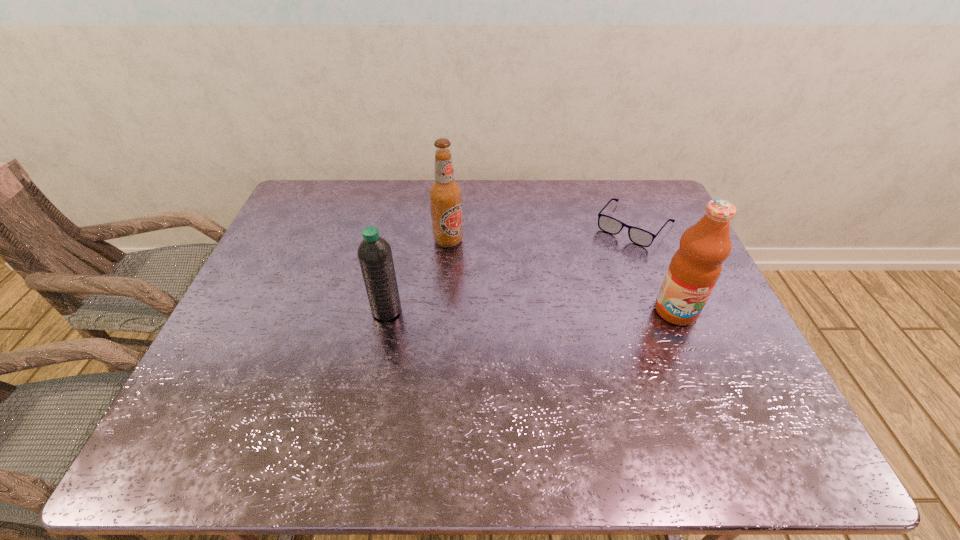
This screenshot has width=960, height=540. Find the location of `vacant space located on the front label of the beer bottle`. vacant space located on the front label of the beer bottle is located at coordinates (484, 284).

Locate an element on the screen. free region located on the front label of the beer bottle is located at coordinates (524, 333).

At what (x,y) coordinates should I click in order to perform the action: click on vacant space located on the front label of the beer bottle. Please return your answer as a coordinate pair (x, y). The height and width of the screenshot is (540, 960). Looking at the image, I should click on (521, 330).

Identify the location of object situated at the far edge. Image resolution: width=960 pixels, height=540 pixels. (610, 225).

You are a GUI agent. You are given a task and a screenshot of the screen. Output one action in this format:
    pyautogui.click(x=<x>, y=<y>)
    Task: Click on the fruit juice situated at the right edge
    The width and height of the screenshot is (960, 540).
    Given the screenshot: What is the action you would take?
    pyautogui.click(x=694, y=269)

Where is `spectacles situated at the right edge`? spectacles situated at the right edge is located at coordinates (610, 225).

Locate an element on the screen. This screenshot has height=540, width=960. object that is at the far right corner is located at coordinates (610, 225).

The width and height of the screenshot is (960, 540). Find the location of `free spot at the far edge of the desktop`. free spot at the far edge of the desktop is located at coordinates (589, 201).

In the image, there is a desktop. Where is `vacant space at the near edge`? vacant space at the near edge is located at coordinates (449, 390).

You are a GUI agent. You are given a task and a screenshot of the screen. Output one action in this format:
    pyautogui.click(x=<x>, y=<y>)
    Task: Click on the vacant space at the left edge of the desktop
    The height and width of the screenshot is (540, 960).
    Given the screenshot: What is the action you would take?
    pyautogui.click(x=278, y=265)